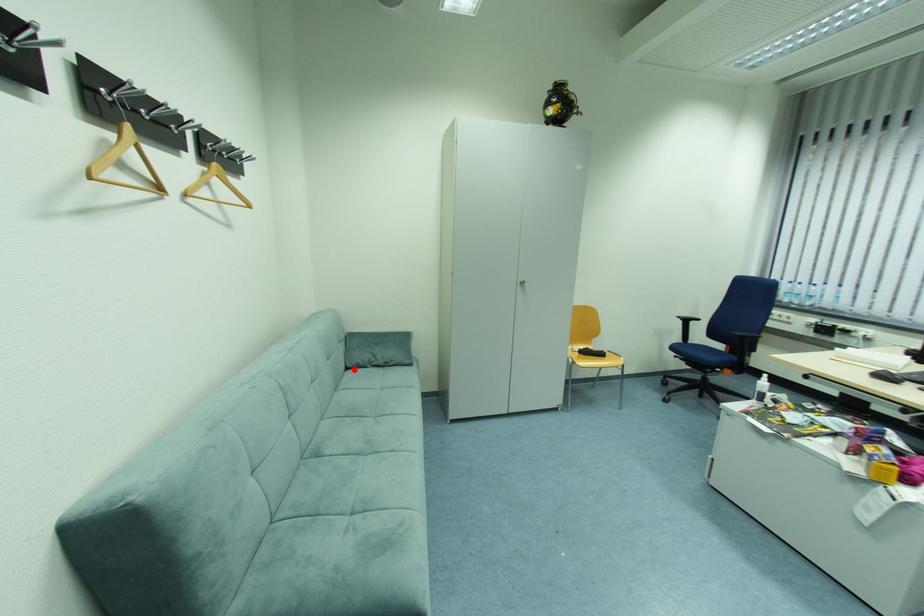
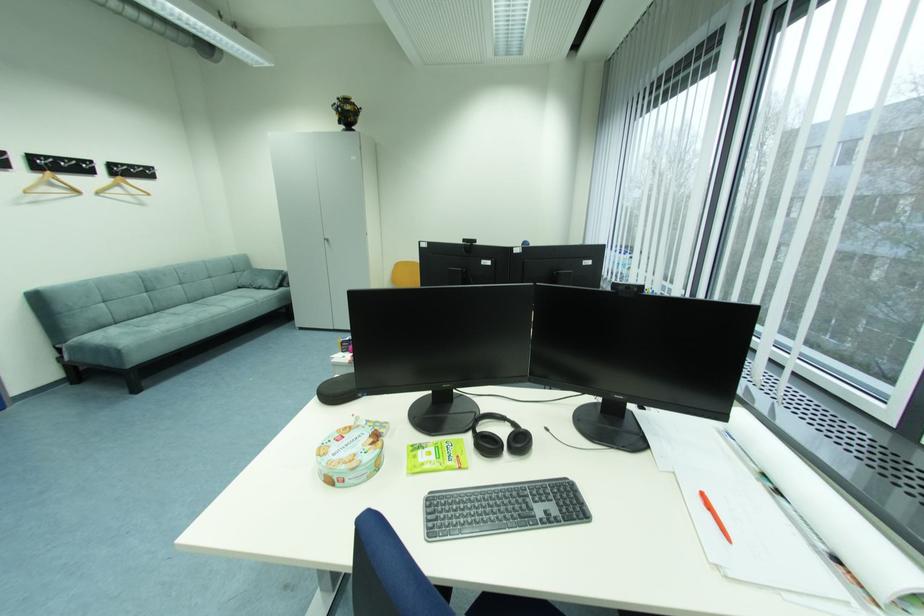
The point at the highlighted location is marked in the first image. Where is the corresponding point in the second image?

(246, 288)